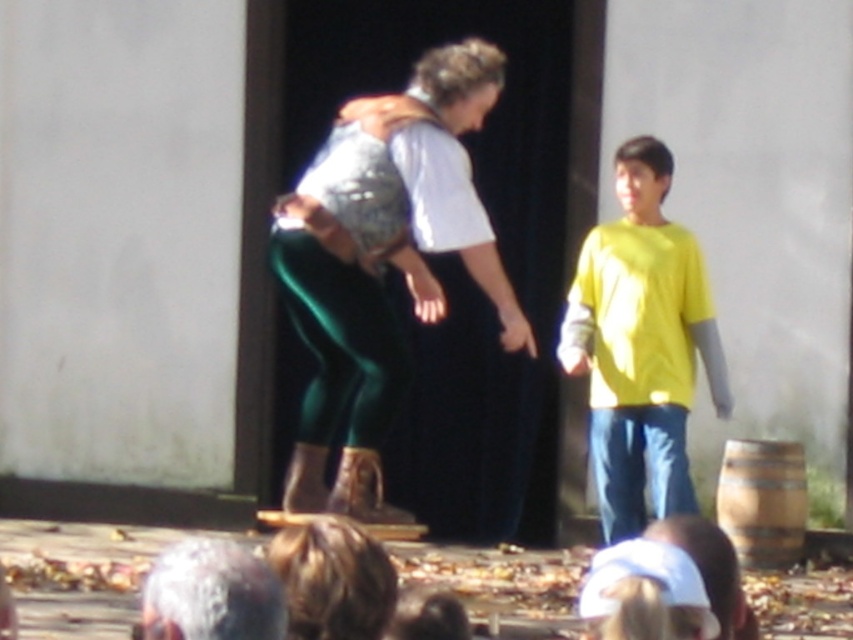
You are a photographer trying to capture a candid shot of the adult and child in the scene. You notice the green velvet pants at center and the blonde hair at lower center. Which object should you focus on first if you want to capture the subject closer to the right side of your frame?

The green velvet pants at center is positioned on the right side of blonde hair at lower center, so you should focus on the green velvet pants at center first to capture the subject closer to the right side of your frame.

You are a photographer positioned behind the audience members. You want to capture a photo of both the yellow matte shirt at center and the blonde hair at lower center in the same frame. Which subject should you focus on first to ensure both are in the shot?

The yellow matte shirt at center is taller than the blonde hair at lower center. Therefore, focus on the yellow matte shirt at center first to ensure both subjects are captured in the frame.